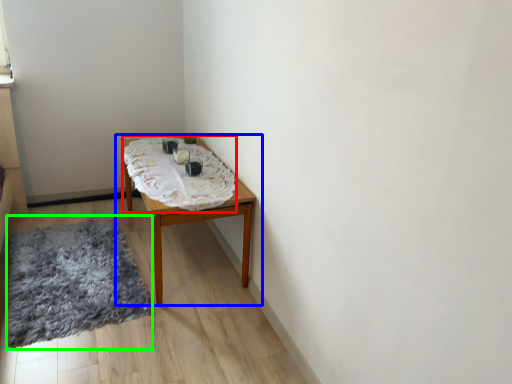
Question: Considering the real-world distances, which object is closest to blanket (highlighted by a red box)? table (highlighted by a blue box) or mat (highlighted by a green box).

Choices:
 (A) table
 (B) mat

Answer: (A)